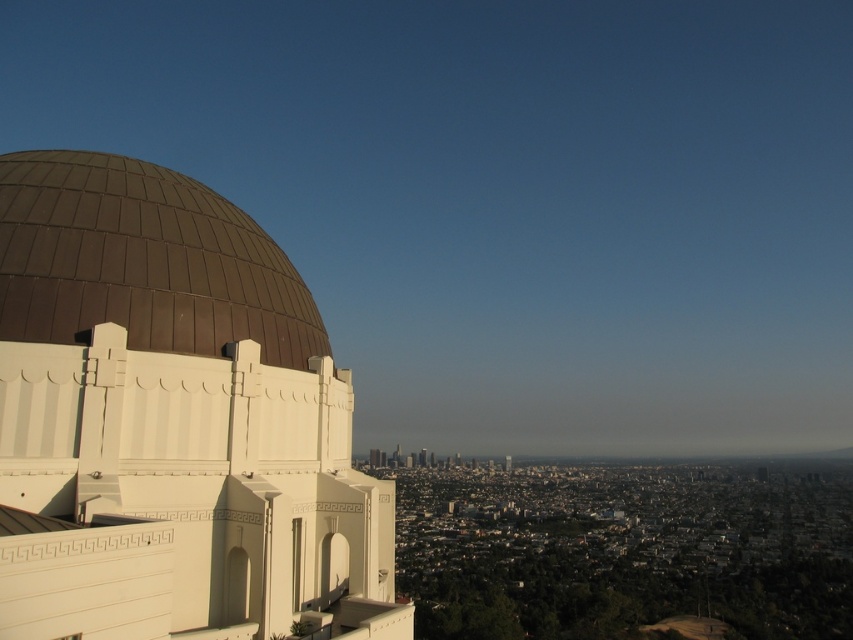
You are a city planner reviewing a blueprint of the cityscape. The blueprint has a coordinate system where the bottom left corner is the origin point. Where is the brown matte dome at upper left located in terms of coordinates?

The brown matte dome at upper left is located at coordinates point [172,422].

You are an architect analyzing the cityscape. You need to determine which dome has a greater diameter between the brown matte dome at upper left and the brown metallic dome at left. Which one is wider?

The brown metallic dome at left has a greater diameter than the brown matte dome at upper left since the brown matte dome at upper left is thinner than brown metallic dome at left.

You are an architect analyzing the cityscape. You notice two domes in the image. Which dome, the brown matte dome at upper left or the brown metallic dome at left, occupies a greater area in the image?

The brown matte dome at upper left has a larger size compared to the brown metallic dome at left, so it occupies a greater area in the image.